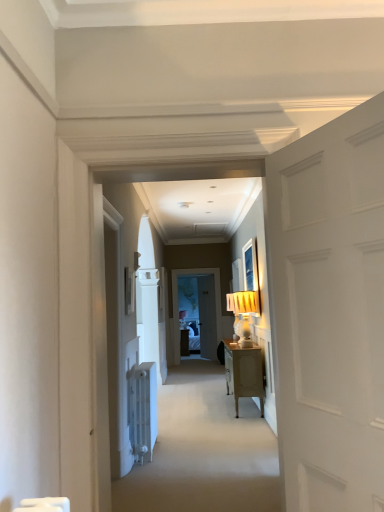
Question: Can you confirm if carpet at center is bigger than matte white picture frame at upper left?

Choices:
 (A) yes
 (B) no

Answer: (A)

Question: Is carpet at center far away from matte white picture frame at upper left?

Choices:
 (A) no
 (B) yes

Answer: (B)

Question: Is carpet at center not within matte white picture frame at upper left?

Choices:
 (A) yes
 (B) no

Answer: (A)

Question: From a real-world perspective, is carpet at center located higher than matte white picture frame at upper left?

Choices:
 (A) yes
 (B) no

Answer: (B)

Question: From a real-world perspective, is carpet at center located beneath matte white picture frame at upper left?

Choices:
 (A) yes
 (B) no

Answer: (A)

Question: Is matte white picture frame at upper left a part of carpet at center?

Choices:
 (A) yes
 (B) no

Answer: (B)

Question: Is the surface of white matte door at right in direct contact with matte white picture frame at upper left?

Choices:
 (A) yes
 (B) no

Answer: (B)

Question: Does white matte door at right have a lesser width compared to matte white picture frame at upper left?

Choices:
 (A) yes
 (B) no

Answer: (B)

Question: Is white matte door at right positioned far away from matte white picture frame at upper left?

Choices:
 (A) no
 (B) yes

Answer: (B)

Question: Is white matte door at right closer to the viewer compared to matte white picture frame at upper left?

Choices:
 (A) yes
 (B) no

Answer: (A)

Question: From a real-world perspective, is white matte door at right on top of matte white picture frame at upper left?

Choices:
 (A) yes
 (B) no

Answer: (B)

Question: From the image's perspective, is white matte door at right on top of matte white picture frame at upper left?

Choices:
 (A) no
 (B) yes

Answer: (B)

Question: From a real-world perspective, is carpet at center below white matte door at right?

Choices:
 (A) yes
 (B) no

Answer: (A)